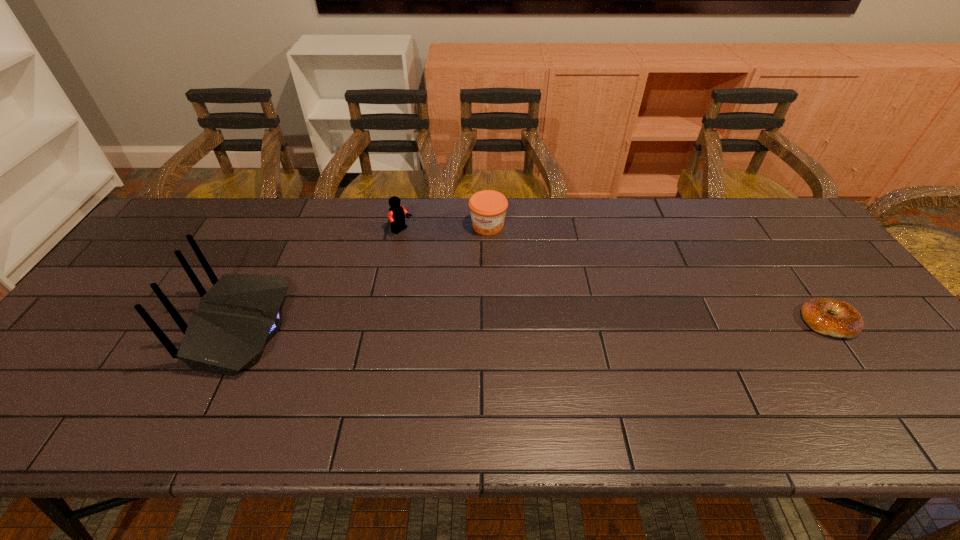
Where is `vacant space located 0.250m on the back of the tallest object`? vacant space located 0.250m on the back of the tallest object is located at coordinates (102, 327).

What are the coordinates of `vacant point located 0.150m on the back of the rightmost object` in the screenshot? It's located at (788, 264).

You are a GUI agent. You are given a task and a screenshot of the screen. Output one action in this format:
    pyautogui.click(x=<x>, y=<y>)
    Task: Click on the free space located 0.260m on the front label of the jam
    This screenshot has width=960, height=540.
    Given the screenshot: What is the action you would take?
    pyautogui.click(x=460, y=299)

Where is `vacant space located on the front label of the jam`? vacant space located on the front label of the jam is located at coordinates (470, 271).

I want to click on vacant space located on the front label of the jam, so click(x=466, y=284).

Identify the location of vacant region located 0.390m on the front-facing side of the third object from right to left. (501, 305).

You are a GUI agent. You are given a task and a screenshot of the screen. Output one action in this format:
    pyautogui.click(x=<x>, y=<y>)
    Task: Click on the vacant space located 0.360m on the front-facing side of the third object from right to left
    
    Given the screenshot: What is the action you would take?
    pyautogui.click(x=492, y=298)

Find the location of a particular element. The height and width of the screenshot is (540, 960). free location located on the front-facing side of the third object from right to left is located at coordinates (472, 283).

I want to click on jam at the far edge, so click(488, 208).

Where is `Lego that is at the far edge`? Lego that is at the far edge is located at coordinates (397, 212).